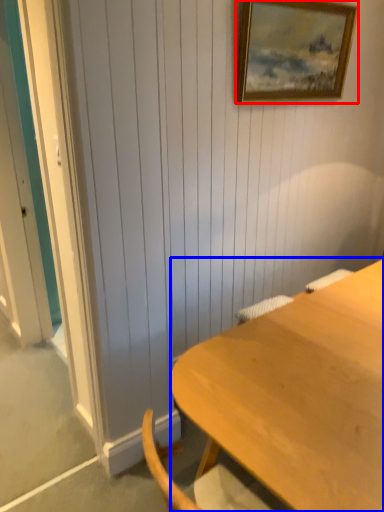
Question: Which object appears farthest to the camera in this image, picture frame (highlighted by a red box) or desk (highlighted by a blue box)?

Choices:
 (A) picture frame
 (B) desk

Answer: (A)